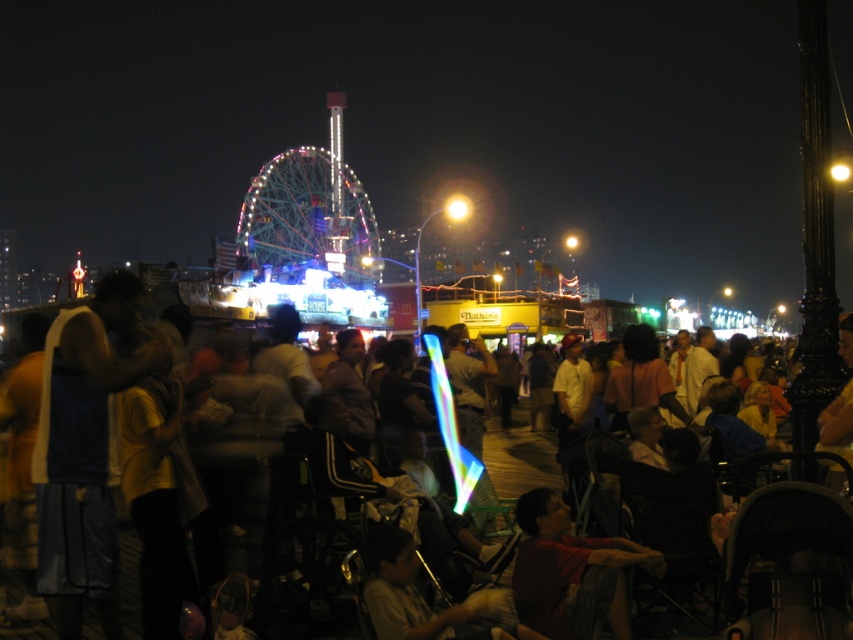
Who is more forward, (312,176) or (527,557)?

Positioned in front is point (527,557).

Between multicolored metallic ferris wheel at center and red shirt at lower right, which one has less height?

red shirt at lower right is shorter.

Describe the element at coordinates (306, 218) in the screenshot. Image resolution: width=853 pixels, height=640 pixels. I see `multicolored metallic ferris wheel at center` at that location.

The height and width of the screenshot is (640, 853). What are the coordinates of `multicolored metallic ferris wheel at center` in the screenshot? It's located at (306, 218).